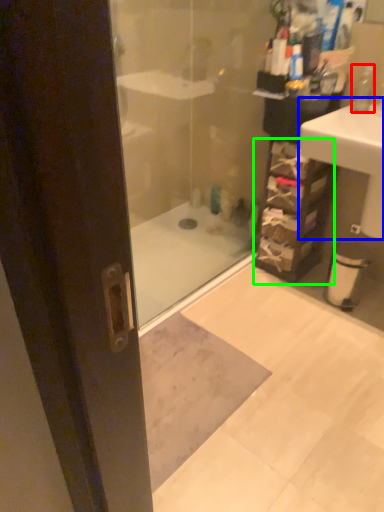
Question: Estimate the real-world distances between objects in this image. Which object is farther from soap dispenser (highlighted by a red box), sink (highlighted by a blue box) or shelf (highlighted by a green box)?

Choices:
 (A) sink
 (B) shelf

Answer: (B)